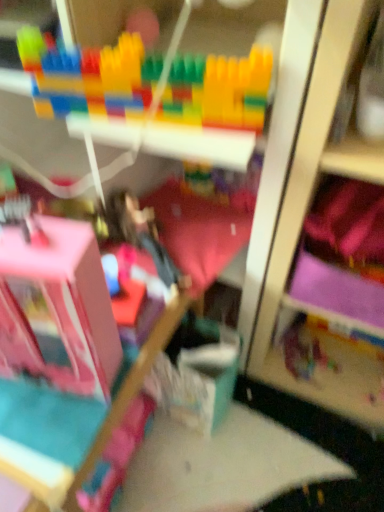
In order to click on vacant space in front of pink plastic dollhouse at lower left, the 1th toy positioned from the front in this screenshot , I will do `click(39, 423)`.